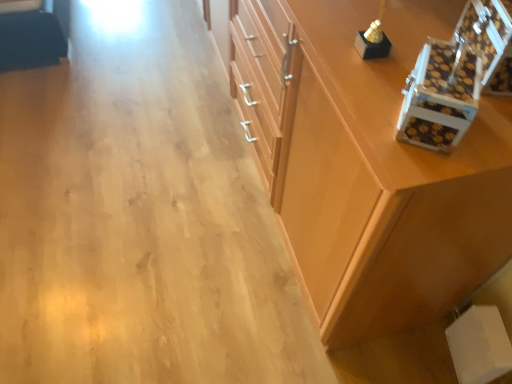
Where is `vacant area that is in front of white textured box at upper right, the second box in the right-to-left sequence`? The height and width of the screenshot is (384, 512). vacant area that is in front of white textured box at upper right, the second box in the right-to-left sequence is located at coordinates [x=435, y=168].